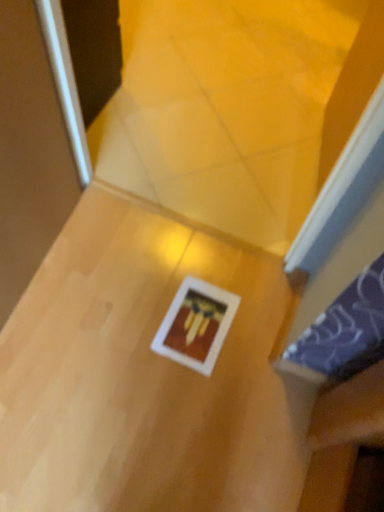
The width and height of the screenshot is (384, 512). In order to click on wooden table at center in this screenshot , I will do `click(145, 377)`.

What do you see at coordinates (145, 377) in the screenshot?
I see `wooden table at center` at bounding box center [145, 377].

Measure the distance between wooden table at center and camera.

The distance of wooden table at center from camera is 3.75 feet.

What do you see at coordinates (196, 325) in the screenshot? The height and width of the screenshot is (512, 384). I see `white matte picture frame at center` at bounding box center [196, 325].

The width and height of the screenshot is (384, 512). What are the coordinates of `white matte picture frame at center` in the screenshot? It's located at (196, 325).

Find the location of `wooden table at center`. wooden table at center is located at coordinates (x=145, y=377).

Considering the positions of objects white matte picture frame at center and wooden table at center in the image provided, who is more to the right, white matte picture frame at center or wooden table at center?

Positioned to the right is white matte picture frame at center.

Based on the photo, is white matte picture frame at center further to the viewer compared to wooden table at center?

Yes.

Is point (217, 352) positioned before point (65, 273)?

Yes, it is.

From the image's perspective, is white matte picture frame at center above or below wooden table at center?

white matte picture frame at center is above wooden table at center.

From a real-world perspective, relative to wooden table at center, is white matte picture frame at center vertically above or below?

From a real-world perspective, white matte picture frame at center is physically below wooden table at center.

Considering the sizes of objects white matte picture frame at center and wooden table at center in the image provided, who is thinner, white matte picture frame at center or wooden table at center?

white matte picture frame at center is thinner.

In terms of height, does white matte picture frame at center look taller or shorter compared to wooden table at center?

In the image, white matte picture frame at center appears to be shorter than wooden table at center.

Does white matte picture frame at center have a smaller size compared to wooden table at center?

Yes.

Is white matte picture frame at center surrounding wooden table at center?

No.

Would you say white matte picture frame at center is a long distance from wooden table at center?

No, white matte picture frame at center is not far away from wooden table at center.

Consider the image. Is white matte picture frame at center oriented away from wooden table at center?

Absolutely, white matte picture frame at center is directed away from wooden table at center.

What's the angular difference between white matte picture frame at center and wooden table at center's facing directions?

They differ by 179 degrees in their facing directions.

In the image, there is a white matte picture frame at center. At what (x,y) coordinates should I click in order to perform the action: click on table below it (from the image's perspective). Please return your answer as a coordinate pair (x, y). Looking at the image, I should click on (145, 377).

Which is more to the left, wooden table at center or white matte picture frame at center?

Positioned to the left is wooden table at center.

Is wooden table at center closer to the viewer compared to white matte picture frame at center?

Yes, wooden table at center is in front of white matte picture frame at center.

Does point (255, 511) come closer to viewer compared to point (194, 339)?

Yes, it is in front of point (194, 339).

From the image's perspective, would you say wooden table at center is shown under white matte picture frame at center?

Yes, from the image's perspective, wooden table at center is beneath white matte picture frame at center.

From a real-world perspective, is wooden table at center physically below white matte picture frame at center?

Incorrect, from a real-world perspective, wooden table at center is higher than white matte picture frame at center.

Based on the photo, between wooden table at center and white matte picture frame at center, which one has smaller width?

Thinner between the two is white matte picture frame at center.

Can you confirm if wooden table at center is shorter than white matte picture frame at center?

No.

Is wooden table at center bigger or smaller than white matte picture frame at center?

Considering their sizes, wooden table at center takes up more space than white matte picture frame at center.

Does wooden table at center contain white matte picture frame at center?

Yes, wooden table at center contains white matte picture frame at center.

Can you see wooden table at center touching white matte picture frame at center?

No, wooden table at center is not touching white matte picture frame at center.

Looking at this image, is wooden table at center facing towards white matte picture frame at center?

Yes, wooden table at center is facing white matte picture frame at center.

How different are the orientations of wooden table at center and white matte picture frame at center in degrees?

179 degrees.

You are a GUI agent. You are given a task and a screenshot of the screen. Output one action in this format:
    pyautogui.click(x=<x>, y=<y>)
    Task: Click on the picture frame on the right of wooden table at center
    The width and height of the screenshot is (384, 512).
    Given the screenshot: What is the action you would take?
    pyautogui.click(x=196, y=325)

In the image, there is a wooden table at center. At what (x,y) coordinates should I click in order to perform the action: click on picture frame above it (from the image's perspective). Please return your answer as a coordinate pair (x, y). This screenshot has height=512, width=384. Looking at the image, I should click on (196, 325).

Where is `table located in front of the white matte picture frame at center`? This screenshot has height=512, width=384. table located in front of the white matte picture frame at center is located at coordinates (145, 377).